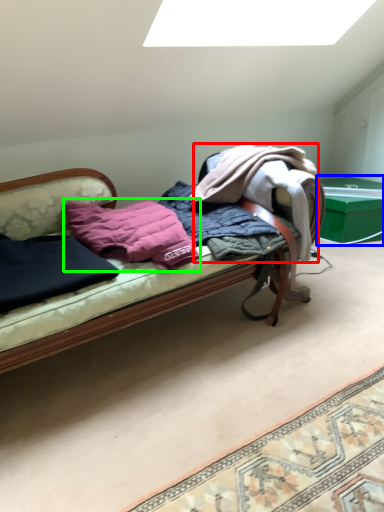
Question: Which object is positioned farthest from clothing (highlighted by a red box)? Select from table (highlighted by a blue box) and pillow (highlighted by a green box).

Choices:
 (A) table
 (B) pillow

Answer: (A)